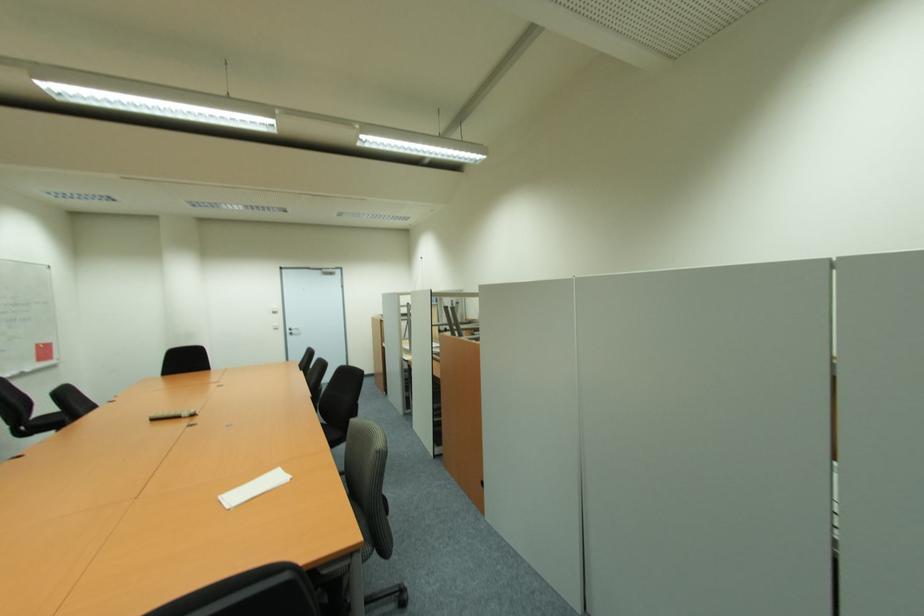
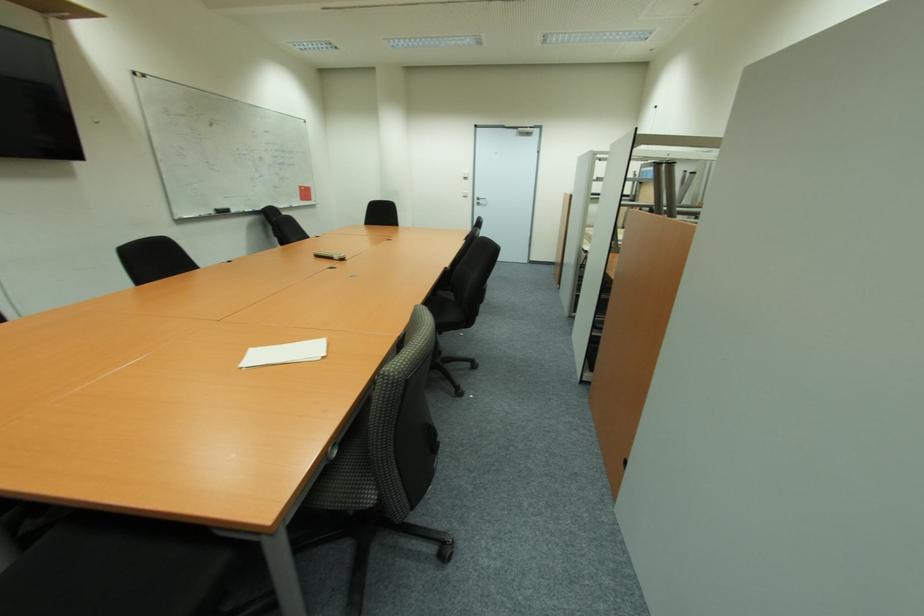
In the second image, find the point that corresponds to [179,418] in the first image.

(334, 259)